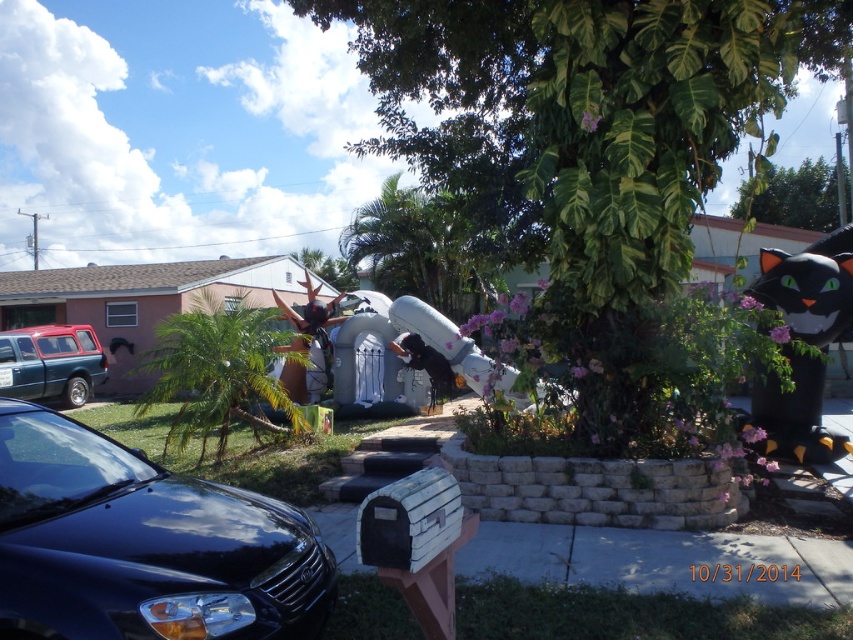
Between point (167, 616) and point (53, 355), which one is positioned in front?

Point (167, 616) is more forward.

Which is below, glossy black car at lower left or metallic red station wagon at left?

glossy black car at lower left

Does point (7, 529) come behind point (80, 394)?

No, (7, 529) is in front of (80, 394).

Image resolution: width=853 pixels, height=640 pixels. Find the location of `glossy black car at lower left`. glossy black car at lower left is located at coordinates (143, 545).

Is point (48, 428) more distant than point (310, 337)?

No, (48, 428) is in front of (310, 337).

Who is taller, glossy black car at lower left or shiny metallic reindeer at center?

shiny metallic reindeer at center

Which is behind, point (0, 541) or point (310, 320)?

The point (310, 320) is more distant.

At what (x,y) coordinates should I click in order to perform the action: click on glossy black car at lower left. Please return your answer as a coordinate pair (x, y). Looking at the image, I should click on (143, 545).

Image resolution: width=853 pixels, height=640 pixels. What do you see at coordinates (143, 545) in the screenshot?
I see `glossy black car at lower left` at bounding box center [143, 545].

Can you confirm if glossy black car at lower left is positioned to the left of black matte cat at right?

Yes, glossy black car at lower left is to the left of black matte cat at right.

Locate an element on the screen. glossy black car at lower left is located at coordinates (143, 545).